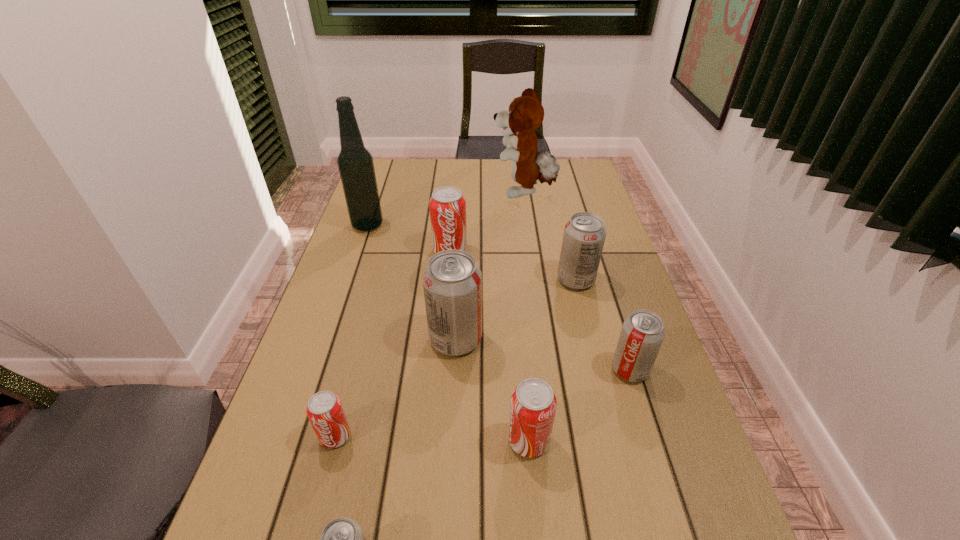
What are the coordinates of `vacant space situated 0.160m on the logo side of the farthest red soda can` in the screenshot? It's located at (446, 300).

Locate an element on the screen. This screenshot has width=960, height=540. free spot located 0.150m on the back of the fourth farthest object is located at coordinates (565, 237).

This screenshot has height=540, width=960. I want to click on blank space located on the back of the third biggest gray soda can, so click(x=593, y=252).

Where is `free spot located 0.150m on the logo side of the fifth soda can from left to right`? The image size is (960, 540). free spot located 0.150m on the logo side of the fifth soda can from left to right is located at coordinates (431, 440).

The image size is (960, 540). Identify the location of vacant position located on the logo side of the fifth soda can from left to right. (400, 440).

In order to click on free location located 0.280m on the logo side of the fifth soda can from left to right in this screenshot , I will do [x=365, y=440].

The image size is (960, 540). Identify the location of free location located on the logo side of the leftmost soda can. (322, 488).

Find the location of a particular element. object situated at the far edge is located at coordinates (525, 114).

The image size is (960, 540). Find the location of `alcohol that is at the left edge`. alcohol that is at the left edge is located at coordinates (355, 163).

Where is `soda can that is positioned at the left edge`? soda can that is positioned at the left edge is located at coordinates [x=324, y=410].